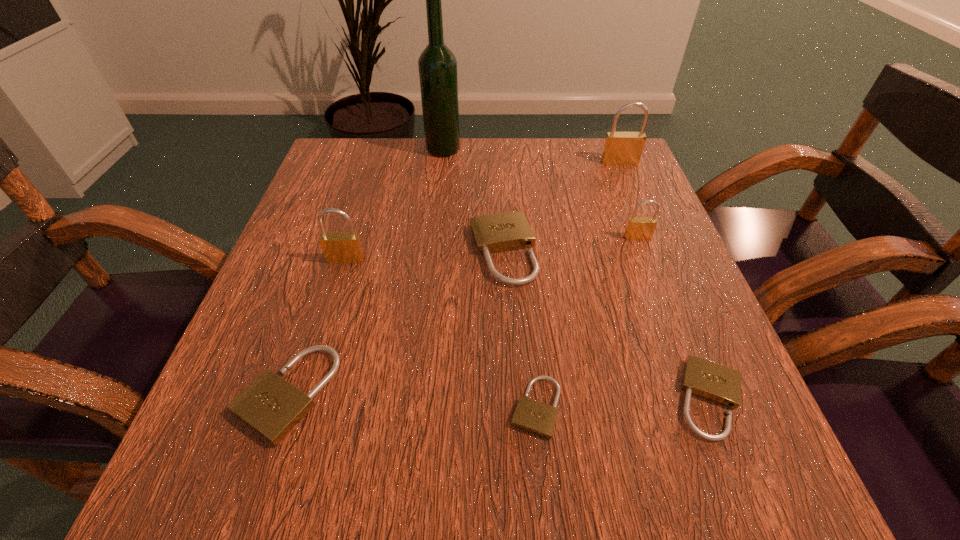
This screenshot has width=960, height=540. I want to click on free spot between the second nearest brass padlock and the fifth tallest object, so click(x=570, y=245).

Where is `blank region between the fourth tallest object and the rightmost beige padlock`? Image resolution: width=960 pixels, height=540 pixels. blank region between the fourth tallest object and the rightmost beige padlock is located at coordinates (674, 318).

Find the location of a particular element. free space between the sixth tallest padlock and the fourth shortest padlock is located at coordinates (607, 326).

At what (x,y) coordinates should I click in order to perform the action: click on empty space that is in between the leftmost beige padlock and the second tallest object. Please return your answer as a coordinate pair (x, y). Looking at the image, I should click on (453, 278).

Identify the location of object that is the fifth closest one to the second shortest padlock. (338, 247).

This screenshot has width=960, height=540. Find the location of `the sixth closest object to the leftmost brass padlock`. the sixth closest object to the leftmost brass padlock is located at coordinates 720,384.

Identify which padlock is the third closest to the biggest brass padlock. Please provide its 2D coordinates. Your answer should be formatted as a tuple, i.e. [(x, y)], where the tuple contains the x and y coordinates of a point satisfying the conditions above.

[(720, 384)]

Where is `padlock identified as the closest to the seventh tallest object`? This screenshot has height=540, width=960. padlock identified as the closest to the seventh tallest object is located at coordinates (538, 418).

Locate which brass padlock ranks in proximity to the leftmost brass padlock. Please provide its 2D coordinates. Your answer should be formatted as a tuple, i.e. [(x, y)], where the tuple contains the x and y coordinates of a point satisfying the conditions above.

[(638, 228)]

Image resolution: width=960 pixels, height=540 pixels. Find the location of `brass padlock that is the closest one to the third shortest padlock`. brass padlock that is the closest one to the third shortest padlock is located at coordinates (338, 247).